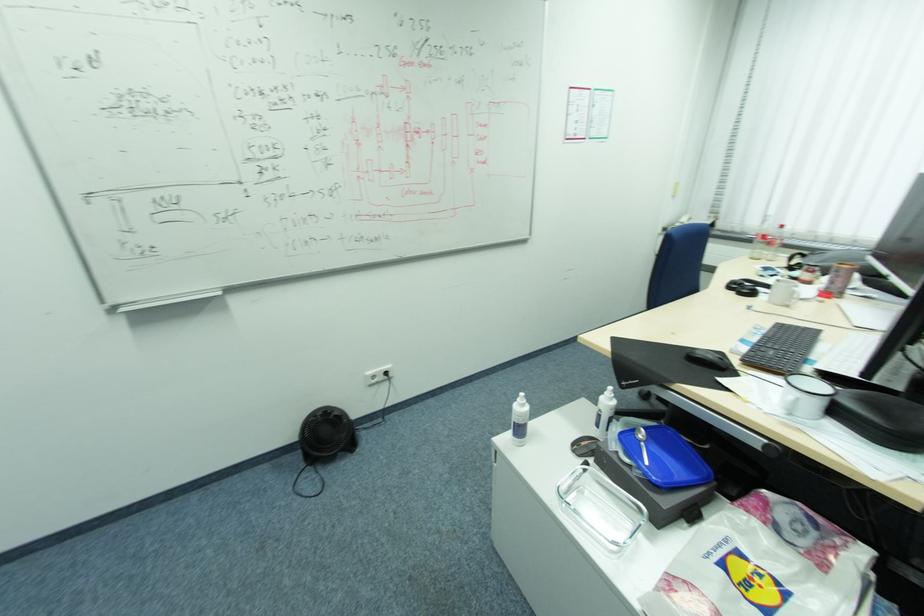
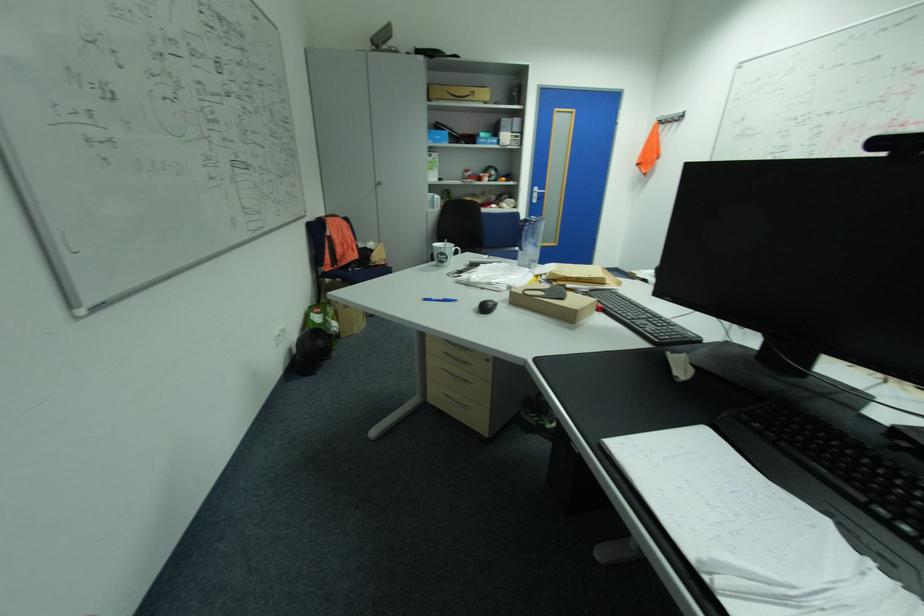
Question: I am providing you with two images of the same scene from different viewpoints. Which of the following objects are not visible in image2?

Choices:
 (A) black computer mouse
 (B) small cardboard box
 (C) white plastic bottle
 (D) dark glass vase

Answer: (C)